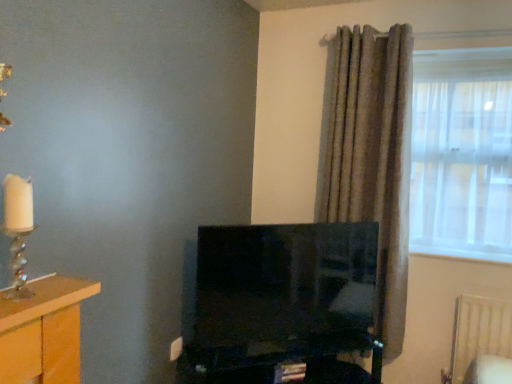
Question: Can you confirm if textured gray curtain at right is taller than wooden table at left?

Choices:
 (A) yes
 (B) no

Answer: (A)

Question: From a real-world perspective, is textured gray curtain at right on top of wooden table at left?

Choices:
 (A) yes
 (B) no

Answer: (A)

Question: Is textured gray curtain at right oriented towards wooden table at left?

Choices:
 (A) yes
 (B) no

Answer: (B)

Question: From the image's perspective, is textured gray curtain at right located beneath wooden table at left?

Choices:
 (A) yes
 (B) no

Answer: (B)

Question: Is textured gray curtain at right turned away from wooden table at left?

Choices:
 (A) yes
 (B) no

Answer: (B)

Question: Is wooden table at left a part of textured gray curtain at right?

Choices:
 (A) yes
 (B) no

Answer: (B)

Question: Is translucent glass candle holder at left aimed at translucent fabric window at right?

Choices:
 (A) yes
 (B) no

Answer: (B)

Question: Considering the relative positions of translucent glass candle holder at left and translucent fabric window at right in the image provided, is translucent glass candle holder at left behind translucent fabric window at right?

Choices:
 (A) no
 (B) yes

Answer: (A)

Question: Considering the relative sizes of translucent glass candle holder at left and translucent fabric window at right in the image provided, is translucent glass candle holder at left bigger than translucent fabric window at right?

Choices:
 (A) no
 (B) yes

Answer: (A)

Question: Considering the relative sizes of translucent glass candle holder at left and translucent fabric window at right in the image provided, is translucent glass candle holder at left shorter than translucent fabric window at right?

Choices:
 (A) yes
 (B) no

Answer: (A)

Question: From the image's perspective, is translucent glass candle holder at left located beneath translucent fabric window at right?

Choices:
 (A) yes
 (B) no

Answer: (A)

Question: Is the surface of translucent glass candle holder at left in direct contact with translucent fabric window at right?

Choices:
 (A) no
 (B) yes

Answer: (A)

Question: Is black glossy computer desk at center located outside textured gray curtain at right?

Choices:
 (A) yes
 (B) no

Answer: (A)